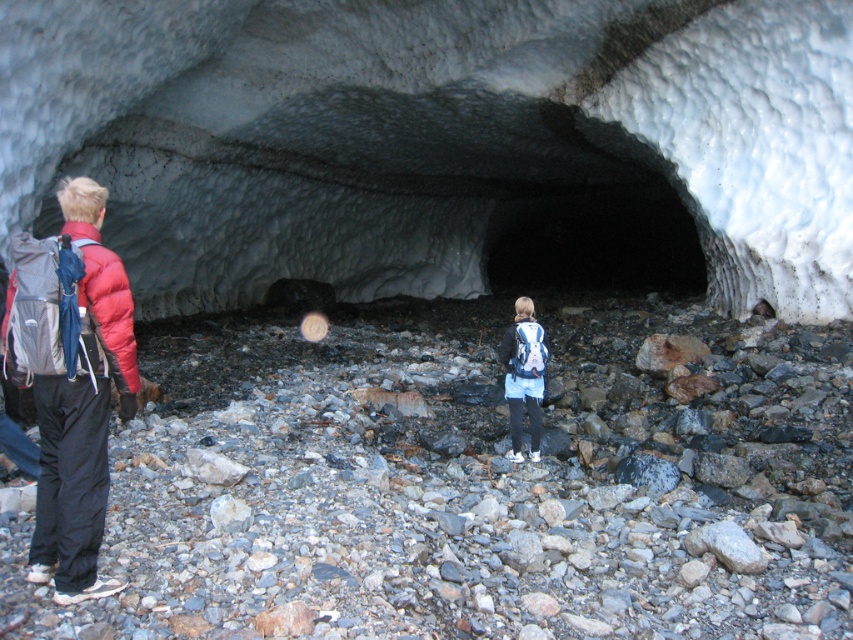
You are planning to enter the white frosty ice cave at center with your matte blue backpack at center. Based on their sizes, can you tell if the entrance is wide enough to allow both you and your backpack to pass through comfortably?

The white frosty ice cave at center is wider than the matte blue backpack at center, so the entrance should be wide enough for both you and your backpack to pass through comfortably.

You are a hiker who has just entered the glacial cave and wants to locate your friend wearing the matte red jacket at left. According to the coordinates provided, in which direction should you move from your current position at the entrance to find them?

The matte red jacket at left is located at coordinates point (74, 392). Since you are at the entrance, moving towards the left side of the cave would lead you to the matte red jacket at left.

You are standing at the entrance of the glacial cave and want to reach a specific point marked at coordinates point (x=352, y=148). If your maximum comfortable walking distance is 50 feet, will you be able to comfortably reach that point?

The distance of point (x=352, y=148) from viewer is 51.65 feet, which exceeds your maximum comfortable walking distance of 50 feet. Therefore, you will not be able to comfortably reach that point.